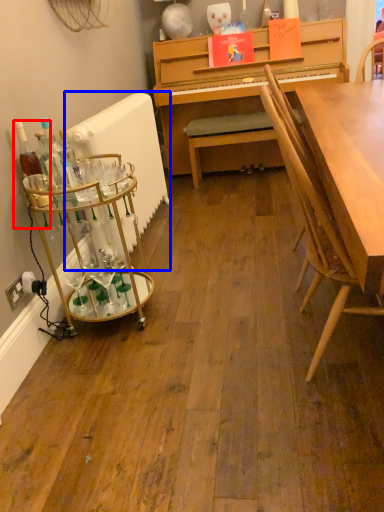
Question: Which of the following is the closest to the observer, bottle (highlighted by a red box) or radiator (highlighted by a blue box)?

Choices:
 (A) bottle
 (B) radiator

Answer: (A)